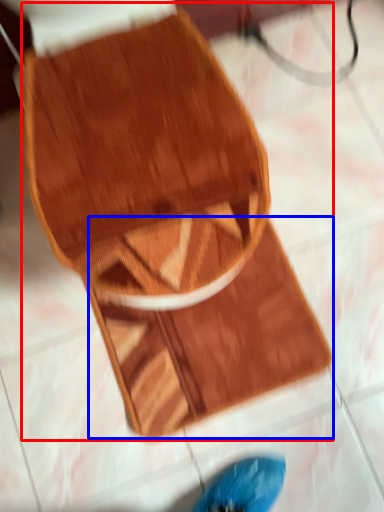
Question: Which of the following is the closest to the observer, footwear (highlighted by a red box) or mat (highlighted by a blue box)?

Choices:
 (A) footwear
 (B) mat

Answer: (A)